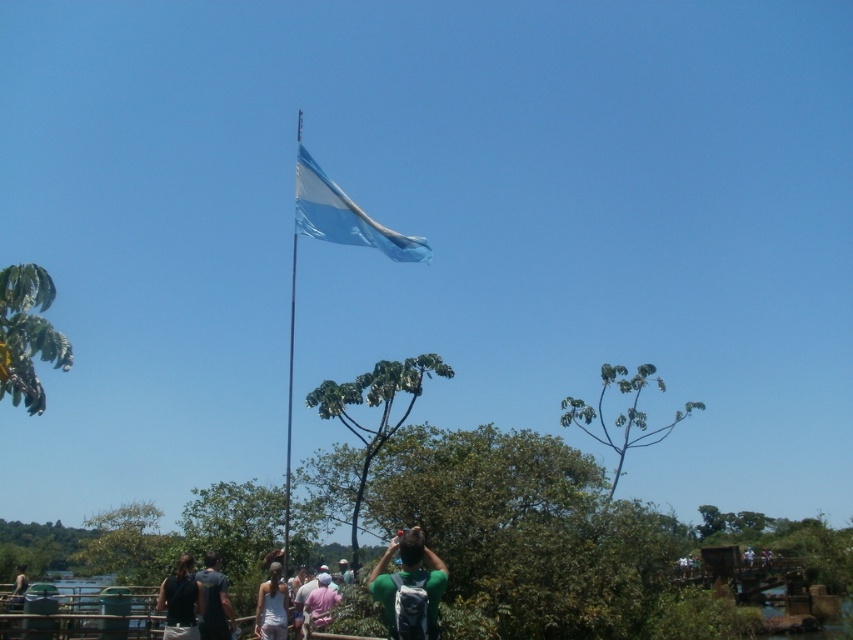
You are trying to decide whether to place your green fabric backpack at center on top of your green fabric shirt at lower center. Based on their sizes, will the backpack fit without hanging over the edges?

The green fabric backpack at center is narrower than the green fabric shirt at lower center, so it should fit without overhanging the edges.

You are standing at the center of the image and see the point at coordinates (409,584). What object is located at that point?

The point at coordinates (409,584) is located on the green fabric backpack at center.

You are a photographer trying to capture both the white cotton shirt at center and the pink fabric shirt at center in the same frame. Which shirt should you adjust your camera angle to focus on first to ensure both are in the shot?

The white cotton shirt at center is to the left of the pink fabric shirt at center. To capture both in the same frame, focus on the white cotton shirt at center first as it is positioned further left, allowing the pink fabric shirt at center to naturally fall into the right side of the frame.